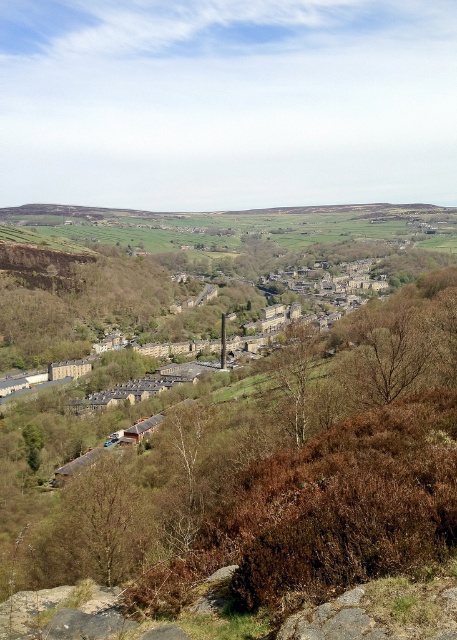
Can you confirm if brown textured tree at lower left is bigger than bare branches at center?

Incorrect, brown textured tree at lower left is not larger than bare branches at center.

From the picture: Who is lower down, brown textured tree at lower left or bare branches at center?

brown textured tree at lower left

Find the location of `brown textured tree at lower left`. brown textured tree at lower left is located at coordinates (105, 518).

The image size is (457, 640). I want to click on brown textured tree at lower left, so click(x=105, y=518).

Which is above, bare branches at center or brown textured tree at center?

Positioned higher is bare branches at center.

What do you see at coordinates (388, 353) in the screenshot? This screenshot has height=640, width=457. I see `bare branches at center` at bounding box center [388, 353].

Find the location of `bare branches at center`. bare branches at center is located at coordinates (388, 353).

Who is more distant from viewer, (76,536) or (302,408)?

Point (302,408)

Between point (133, 477) and point (281, 406), which one is positioned in front?

Point (133, 477)

Is point (101, 545) positioned after point (315, 333)?

No, it is in front of (315, 333).

This screenshot has height=640, width=457. Find the location of `brown textured tree at lower left`. brown textured tree at lower left is located at coordinates (105, 518).